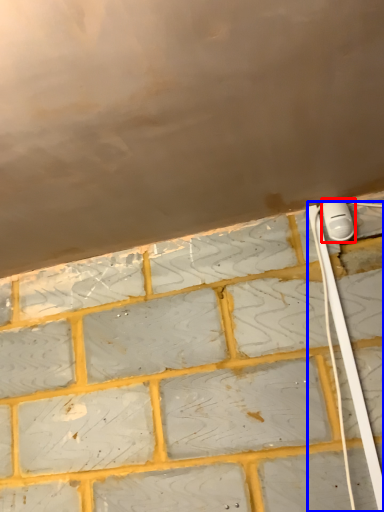
Question: Which object is closer to the camera taking this photo, power plugs and sockets (highlighted by a red box) or cable (highlighted by a blue box)?

Choices:
 (A) power plugs and sockets
 (B) cable

Answer: (B)